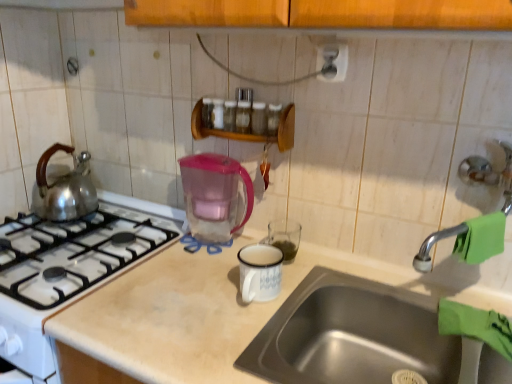
Question: Is point (415, 355) closer or farther from the camera than point (221, 228)?

Choices:
 (A) closer
 (B) farther

Answer: (A)

Question: Based on their positions, is stainless steel sink at lower right located to the left or right of transparent plastic pitcher at center?

Choices:
 (A) left
 (B) right

Answer: (B)

Question: Which object is positioned farthest from the stainless steel sink at lower right?

Choices:
 (A) wooden spice rack at upper center
 (B) green rubber faucet at right
 (C) transparent plastic pitcher at center
 (D) satin silver outlet at upper center

Answer: (D)

Question: Which is farther from the wooden spice rack at upper center?

Choices:
 (A) transparent plastic pitcher at center
 (B) satin silver outlet at upper center
 (C) stainless steel sink at lower right
 (D) green rubber faucet at right

Answer: (D)